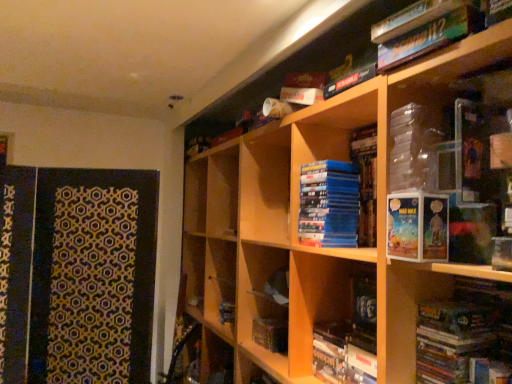
Question: From a real-world perspective, is matte cardboard book at center-right positioned above or below matte blue book at lower center, which is the fourth book in top-to-bottom order?

Choices:
 (A) below
 (B) above

Answer: (B)

Question: Do you think matte cardboard book at center-right is within matte blue book at lower center, the 1th book positioned from the bottom, or outside of it?

Choices:
 (A) inside
 (B) outside

Answer: (B)

Question: Which object is positioned closest to the wooden bookcase at upper right?

Choices:
 (A) matte black book at lower right, which ranks as the second book in bottom-to-top order
 (B) green cardboard book at upper right, acting as the first book starting from the top
 (C) matte blue book at lower center, the 1th book positioned from the bottom
 (D) matte cardboard book at center-right
 (E) blue matte dvd stack at center, placed as the second book when sorted from top to bottom

Answer: (C)

Question: Which object is positioned closest to the matte black book at lower right, placed as the 3th book when sorted from top to bottom?

Choices:
 (A) blue matte dvd stack at center, acting as the third book starting from the bottom
 (B) matte cardboard book at center-right
 (C) matte blue book at lower center, which is the fourth book in top-to-bottom order
 (D) wooden bookcase at upper right
 (E) green cardboard book at upper right, acting as the first book starting from the top

Answer: (B)